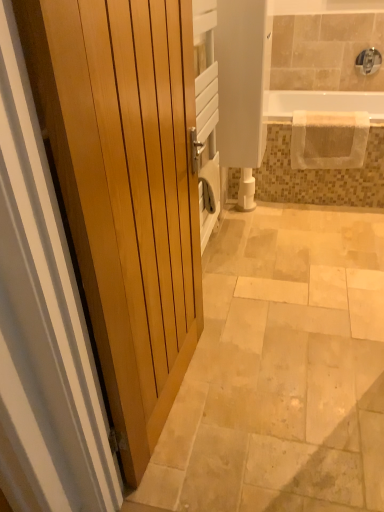
Question: Is beige textured towel at upper right closer to the viewer compared to white glossy toilet paper at center?

Choices:
 (A) yes
 (B) no

Answer: (A)

Question: Would you say white glossy toilet paper at center is part of beige textured towel at upper right's contents?

Choices:
 (A) no
 (B) yes

Answer: (A)

Question: Is beige textured towel at upper right to the right of white glossy toilet paper at center from the viewer's perspective?

Choices:
 (A) yes
 (B) no

Answer: (A)

Question: Does beige textured towel at upper right have a greater width compared to white glossy toilet paper at center?

Choices:
 (A) no
 (B) yes

Answer: (B)

Question: Can you confirm if beige textured towel at upper right is smaller than white glossy toilet paper at center?

Choices:
 (A) yes
 (B) no

Answer: (B)

Question: Is white glossy toilet paper at center at the back of beige textured towel at upper right?

Choices:
 (A) no
 (B) yes

Answer: (A)

Question: Is light wood door at left located outside white textured bathtub at upper right?

Choices:
 (A) no
 (B) yes

Answer: (B)

Question: Does light wood door at left turn towards white textured bathtub at upper right?

Choices:
 (A) no
 (B) yes

Answer: (A)

Question: Is there a large distance between light wood door at left and white textured bathtub at upper right?

Choices:
 (A) yes
 (B) no

Answer: (A)

Question: Does light wood door at left appear on the right side of white textured bathtub at upper right?

Choices:
 (A) no
 (B) yes

Answer: (A)

Question: Does light wood door at left have a smaller size compared to white textured bathtub at upper right?

Choices:
 (A) no
 (B) yes

Answer: (A)

Question: From a real-world perspective, is light wood door at left located higher than white textured bathtub at upper right?

Choices:
 (A) no
 (B) yes

Answer: (B)

Question: Is silver metallic faucet at upper right oriented away from white glossy toilet paper at center?

Choices:
 (A) yes
 (B) no

Answer: (B)